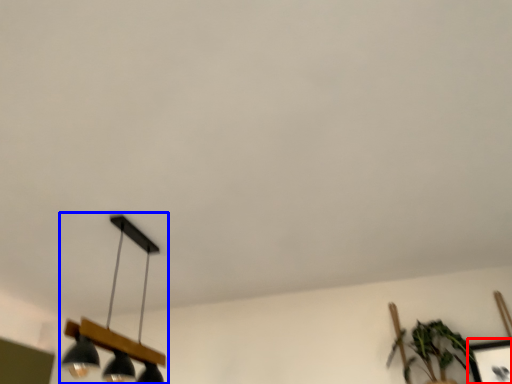
Question: Which point is closer to the camera, picture frame (highlighted by a red box) or lamp (highlighted by a blue box)?

Choices:
 (A) picture frame
 (B) lamp

Answer: (B)